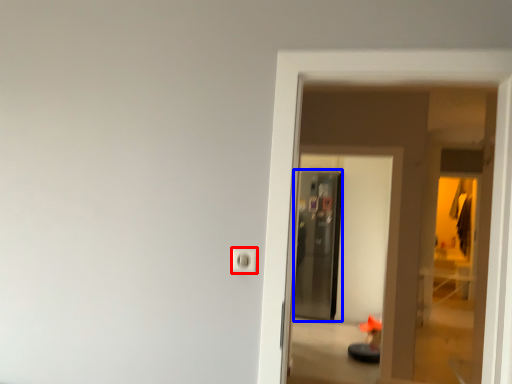
Question: Which point is closer to the camera, electric outlet (highlighted by a red box) or screen door (highlighted by a blue box)?

Choices:
 (A) electric outlet
 (B) screen door

Answer: (A)